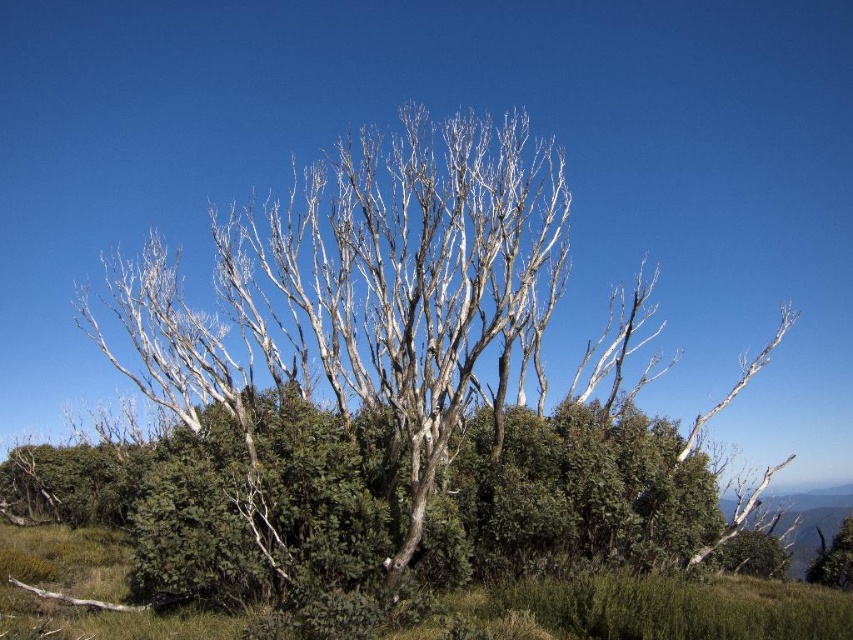
You are standing at the edge of the scene looking towards the center. Which object is positioned to the right side when comparing the white bark tree at center and the green matte grass at lower center?

The white bark tree at center is positioned to the right of the green matte grass at lower center.

You are a hiker standing on the green matte grass at lower center and want to take a photo of the white bark tree at center. Since the grass is part of the foreground, will the tree appear larger or smaller in the photo compared to the grass?

The white bark tree at center is larger in size than the green matte grass at lower center, so in the photo, the tree will appear larger than the grass because it is actually bigger in reality.